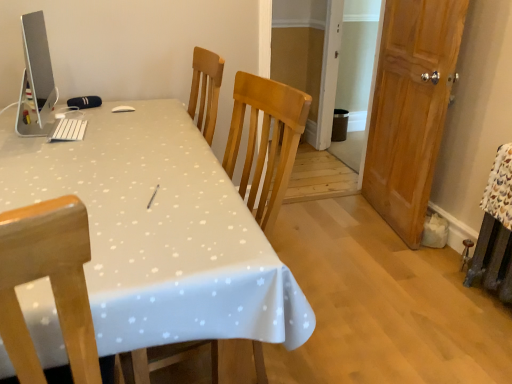
You are a GUI agent. You are given a task and a screenshot of the screen. Output one action in this format:
    pyautogui.click(x=<x>, y=<y>)
    Task: Click on the free location to the left of wooden door at right
    
    Given the screenshot: What is the action you would take?
    pyautogui.click(x=337, y=221)